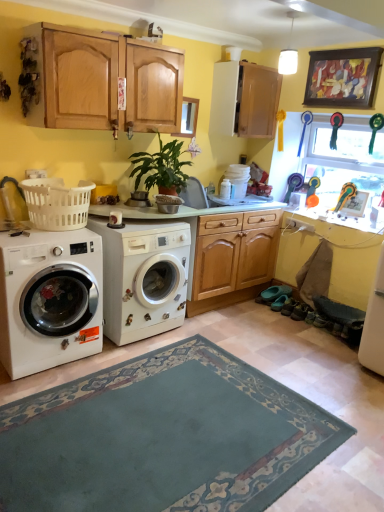
Question: From the image's perspective, is white matte washing machine at center, marked as the 1th washing machine in a right-to-left arrangement, below white matte washing machine at left, arranged as the second washing machine when viewed from the right?

Choices:
 (A) no
 (B) yes

Answer: (A)

Question: Are white matte washing machine at center, marked as the 1th washing machine in a right-to-left arrangement, and white matte washing machine at left, which is counted as the 1th washing machine, starting from the left, far apart?

Choices:
 (A) no
 (B) yes

Answer: (A)

Question: Can you confirm if white matte washing machine at center, positioned as the 2th washing machine in left-to-right order, is positioned to the right of white matte washing machine at left, arranged as the second washing machine when viewed from the right?

Choices:
 (A) no
 (B) yes

Answer: (B)

Question: Can you confirm if white matte washing machine at center, positioned as the 2th washing machine in left-to-right order, is taller than white matte washing machine at left, arranged as the second washing machine when viewed from the right?

Choices:
 (A) no
 (B) yes

Answer: (B)

Question: From a real-world perspective, is white matte washing machine at center, marked as the 1th washing machine in a right-to-left arrangement, positioned under white matte washing machine at left, arranged as the second washing machine when viewed from the right, based on gravity?

Choices:
 (A) yes
 (B) no

Answer: (A)

Question: From the image's perspective, is wooden cabinet at upper center positioned above or below white glossy counter top at lower right?

Choices:
 (A) below
 (B) above

Answer: (B)

Question: Do you think wooden cabinet at upper center is within white glossy counter top at lower right, or outside of it?

Choices:
 (A) inside
 (B) outside

Answer: (B)

Question: In terms of size, does wooden cabinet at upper center appear bigger or smaller than white glossy counter top at lower right?

Choices:
 (A) big
 (B) small

Answer: (A)

Question: Considering the positions of point (264, 133) and point (294, 209), is point (264, 133) closer or farther from the camera than point (294, 209)?

Choices:
 (A) farther
 (B) closer

Answer: (B)

Question: Is point (382, 221) positioned closer to the camera than point (230, 131)?

Choices:
 (A) farther
 (B) closer

Answer: (B)

Question: From a real-world perspective, is white glossy counter top at lower right above or below wooden cabinet at upper center?

Choices:
 (A) below
 (B) above

Answer: (A)

Question: In terms of height, does white glossy counter top at lower right look taller or shorter compared to wooden cabinet at upper center?

Choices:
 (A) short
 (B) tall

Answer: (A)

Question: Would you say white glossy counter top at lower right is to the left or to the right of wooden cabinet at upper center in the picture?

Choices:
 (A) left
 (B) right

Answer: (B)

Question: Considering the relative positions of translucent plastic window screen at upper right and green matte plant at center in the image provided, is translucent plastic window screen at upper right to the left or to the right of green matte plant at center?

Choices:
 (A) right
 (B) left

Answer: (A)

Question: From the image's perspective, is translucent plastic window screen at upper right located above or below green matte plant at center?

Choices:
 (A) above
 (B) below

Answer: (A)